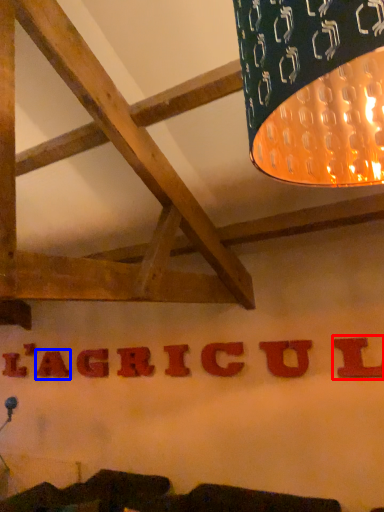
Question: Which of the following is the closest to the observer, letter (highlighted by a red box) or letter (highlighted by a blue box)?

Choices:
 (A) letter
 (B) letter

Answer: (A)